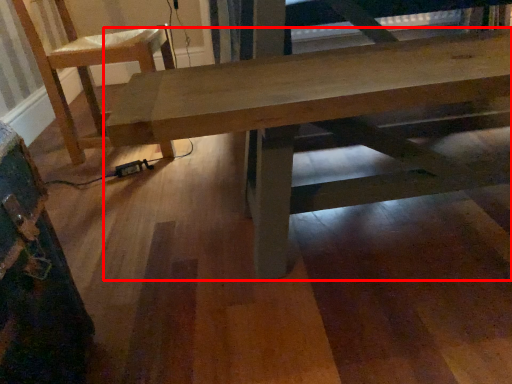
Question: From the image's perspective, what is the correct spatial relationship of table (annotated by the red box) in relation to chair?

Choices:
 (A) above
 (B) below

Answer: (B)